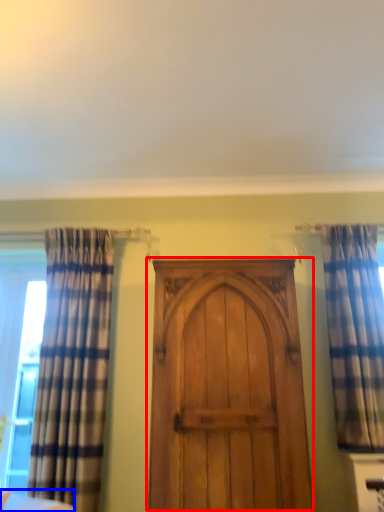
Question: Which point is closer to the camera, door (highlighted by a red box) or furniture (highlighted by a blue box)?

Choices:
 (A) door
 (B) furniture

Answer: (B)